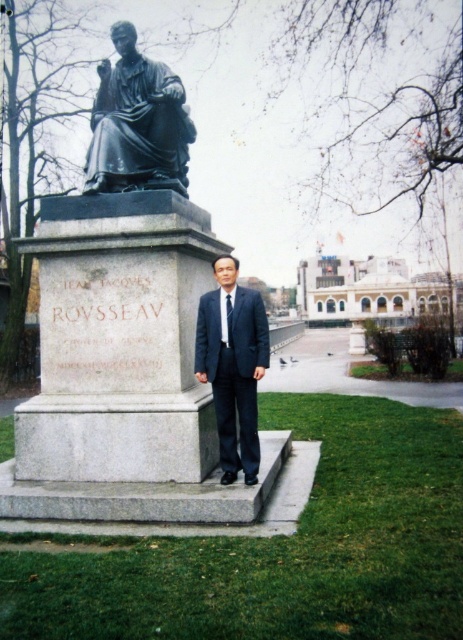
You are a photographer planning to take a picture of the bronze statue at center and the dark blue suit at center. Since you want to emphasize the statue, which object should you focus on first and why?

You should focus on the bronze statue at center first because it is larger in size compared to the dark blue suit at center, making it the more prominent subject.